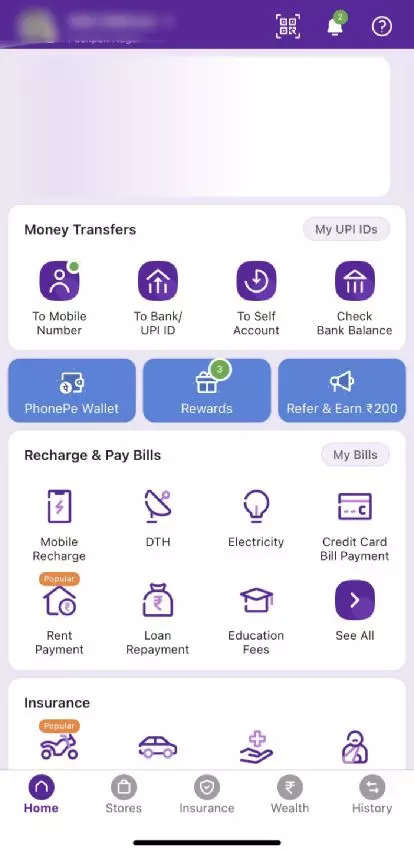
You are a GUI agent. You are given a task and a screenshot of the screen. Output one action in this format:
    pyautogui.click(x=<x>, y=<y>)
    Task: Click on the phones
    
    Given the screenshot: What is the action you would take?
    pyautogui.click(x=61, y=505)